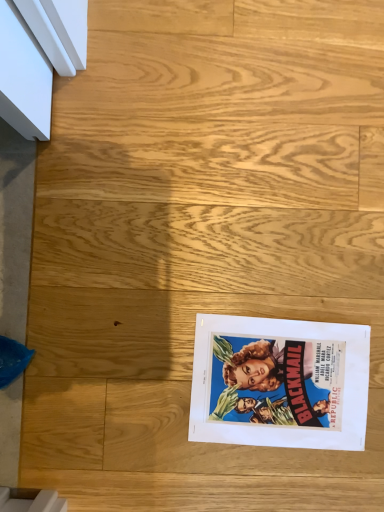
Find the location of `matte paper movie poster at lower right`. matte paper movie poster at lower right is located at coordinates (279, 383).

What is the approximate height of matte paper movie poster at lower right?

matte paper movie poster at lower right is 0.62 inches in height.

This screenshot has height=512, width=384. What do you see at coordinates (279, 383) in the screenshot?
I see `matte paper movie poster at lower right` at bounding box center [279, 383].

At what (x,y) coordinates should I click in order to perform the action: click on matte paper movie poster at lower right. Please return your answer as a coordinate pair (x, y). This screenshot has width=384, height=512. Looking at the image, I should click on (279, 383).